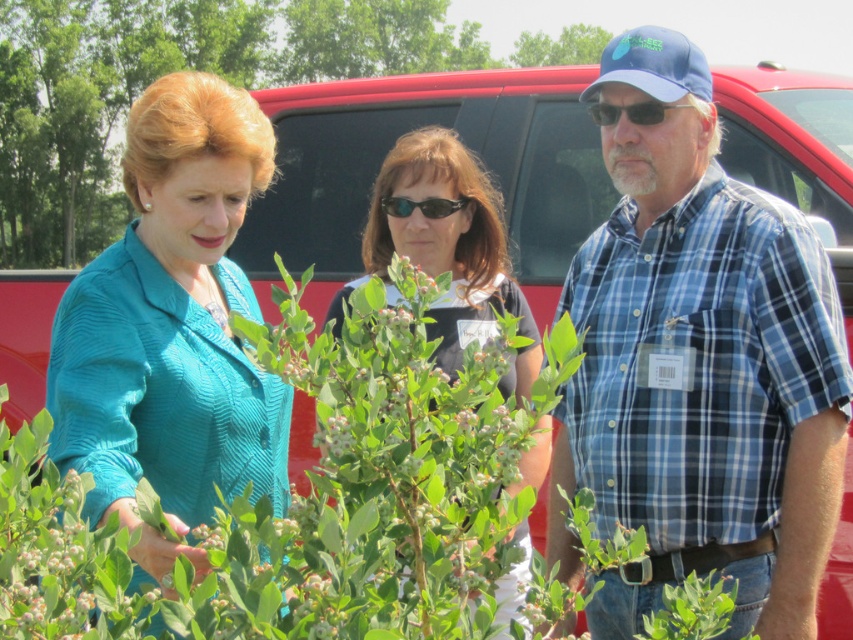
Who is more distant from viewer, (187,403) or (512,566)?

The point (187,403) is more distant.

I want to click on teal fabric jacket at left, so click(172, 321).

Is point (158, 289) positioned after point (444, 257)?

No, (158, 289) is closer to viewer.

Where is `teal fabric jacket at left`? This screenshot has height=640, width=853. teal fabric jacket at left is located at coordinates (172, 321).

Identify the location of green leafy bush at center. The width and height of the screenshot is (853, 640). (378, 481).

Does point (341, 628) lie behind point (39, 264)?

No, it is in front of (39, 264).

Does point (294, 337) come in front of point (97, 28)?

Yes, point (294, 337) is closer to viewer.

Where is `green leafy bush at center`? The height and width of the screenshot is (640, 853). green leafy bush at center is located at coordinates (378, 481).

How distant is blue plaid shirt at center from black plastic goggles at center?

36.12 inches

Find the location of a particular element. This screenshot has width=853, height=640. blue plaid shirt at center is located at coordinates pos(699,365).

Identify the location of blue plaid shirt at center. This screenshot has width=853, height=640. [x=699, y=365].